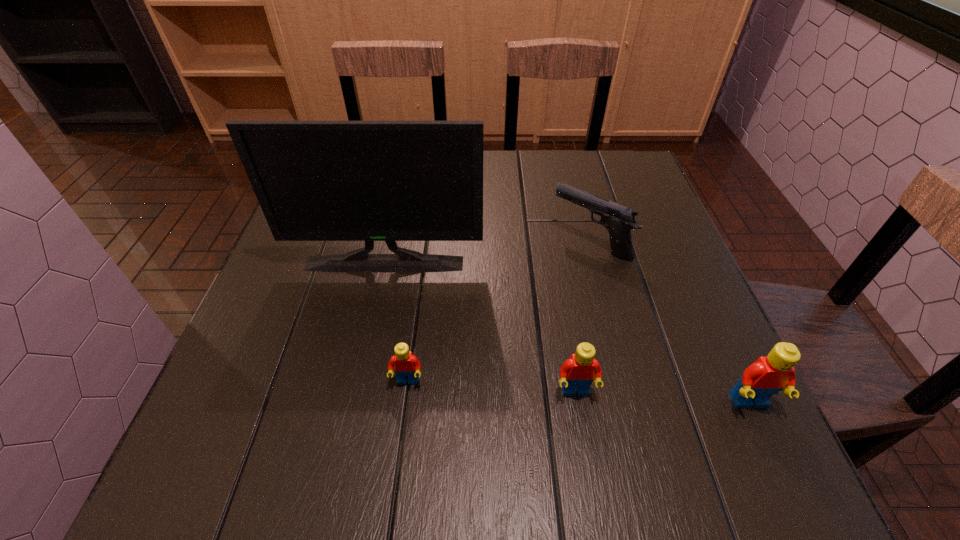
You are a GUI agent. You are given a task and a screenshot of the screen. Output one action in this format:
    pyautogui.click(x=<x>, y=<y>)
    Task: Click on the vacant point located 0.210m on the front-facing side of the monitor
    
    Given the screenshot: What is the action you would take?
    pyautogui.click(x=365, y=353)

Locate an element on the screen. The width and height of the screenshot is (960, 540). object that is at the left edge is located at coordinates (390, 181).

The image size is (960, 540). Identify the location of Lego located in the right edge section of the desktop. (768, 375).

The height and width of the screenshot is (540, 960). Find the location of `gun located in the right edge section of the desktop`. gun located in the right edge section of the desktop is located at coordinates (619, 220).

At what (x,y) coordinates should I click in order to perform the action: click on object that is at the near right corner. Please return your answer as a coordinate pair (x, y). The image size is (960, 540). Looking at the image, I should click on (768, 375).

Locate an element on the screen. vacant region at the far edge of the desktop is located at coordinates (499, 185).

Identify the location of free space at the near edge of the desktop. The image size is (960, 540). (434, 402).

Image resolution: width=960 pixels, height=540 pixels. I want to click on vacant space at the left edge of the desktop, so click(331, 289).

Image resolution: width=960 pixels, height=540 pixels. What are the coordinates of `free space at the right edge` in the screenshot? It's located at (678, 335).

What are the coordinates of `free space at the far right corner` in the screenshot? It's located at (622, 153).